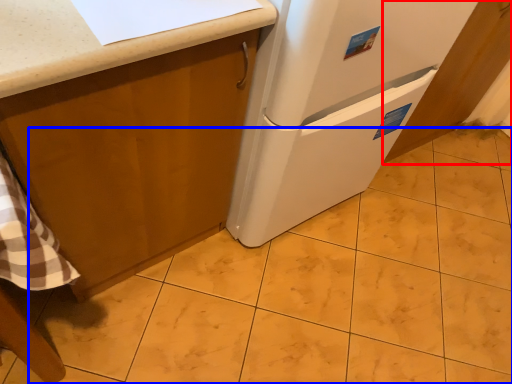
Question: Which point is further to the camera, cabinetry (highlighted by a red box) or tile (highlighted by a blue box)?

Choices:
 (A) cabinetry
 (B) tile

Answer: (A)